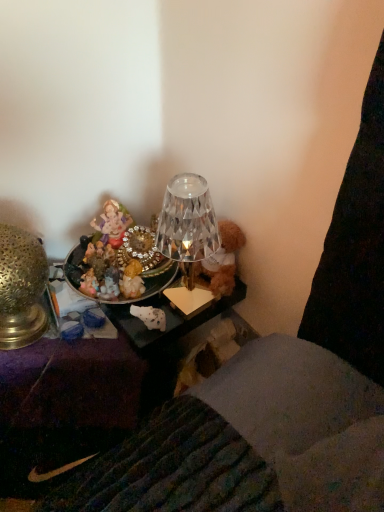
Question: Is metallic/mesh tray at left not within gold textured lamp at left?

Choices:
 (A) yes
 (B) no

Answer: (A)

Question: Can you confirm if metallic/mesh tray at left is wider than gold textured lamp at left?

Choices:
 (A) no
 (B) yes

Answer: (B)

Question: From the image's perspective, does metallic/mesh tray at left appear higher than gold textured lamp at left?

Choices:
 (A) yes
 (B) no

Answer: (B)

Question: Considering the relative sizes of metallic/mesh tray at left and gold textured lamp at left in the image provided, is metallic/mesh tray at left bigger than gold textured lamp at left?

Choices:
 (A) no
 (B) yes

Answer: (B)

Question: Does metallic/mesh tray at left have a lesser height compared to gold textured lamp at left?

Choices:
 (A) no
 (B) yes

Answer: (A)

Question: Does metallic/mesh tray at left appear on the left side of gold textured lamp at left?

Choices:
 (A) yes
 (B) no

Answer: (B)

Question: Can you confirm if gold textured lamp at left is positioned to the left of porcelain figurine at upper center?

Choices:
 (A) yes
 (B) no

Answer: (A)

Question: Does gold textured lamp at left have a lesser height compared to porcelain figurine at upper center?

Choices:
 (A) no
 (B) yes

Answer: (A)

Question: Is gold textured lamp at left thinner than porcelain figurine at upper center?

Choices:
 (A) no
 (B) yes

Answer: (A)

Question: Is gold textured lamp at left far from porcelain figurine at upper center?

Choices:
 (A) no
 (B) yes

Answer: (A)

Question: Is gold textured lamp at left located outside porcelain figurine at upper center?

Choices:
 (A) no
 (B) yes

Answer: (B)

Question: Can you confirm if gold textured lamp at left is smaller than porcelain figurine at upper center?

Choices:
 (A) yes
 (B) no

Answer: (B)

Question: Is porcelain figurine at upper center completely or partially outside of gold textured lamp at left?

Choices:
 (A) yes
 (B) no

Answer: (A)